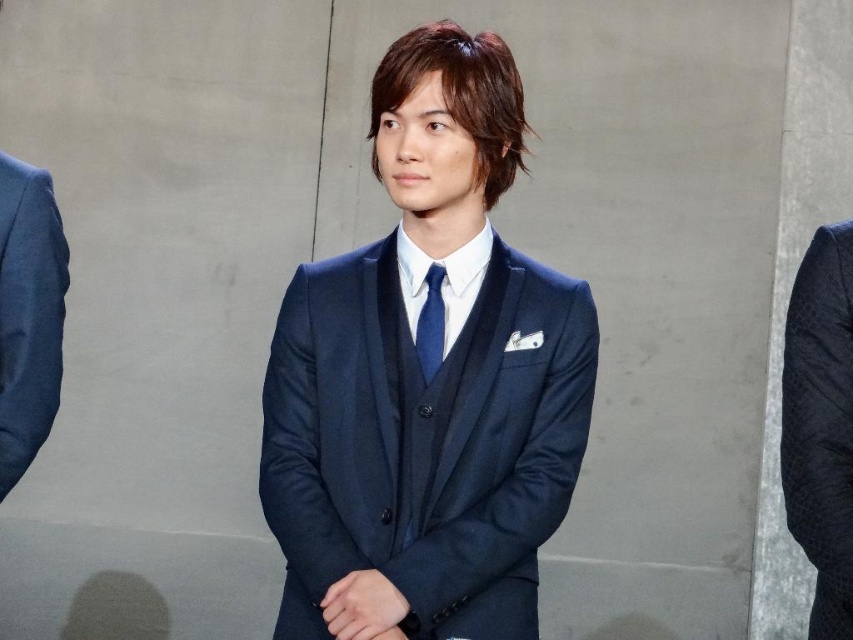
You are a photographer setting up for a formal photoshoot. You need to adjust the lighting so that the matte blue suit at left and the matte blue tie at center are evenly illuminated. Based on their positions, which object should you focus the light on first to ensure proper exposure?

The matte blue suit at left is located above the matte blue tie at center. Since it is higher up, you should focus the light on the matte blue suit at left first to ensure proper exposure before adjusting for the lower positioned tie.

You are a photographer adjusting the focus on your camera. You notice two points of interest in the image, point (x=61, y=348) and point (x=436, y=304). Which point should you focus on first to ensure the subject is sharp?

You should focus on point (x=61, y=348) first because it is closer to the camera than point (x=436, y=304), ensuring the subject appears sharp in the foreground.

You are a tailor measuring a navy blue suit at center and a matte blue tie at center for alterations. Which item requires a smaller amount of fabric for adjustments?

The matte blue tie at center requires less fabric for adjustments since it is smaller in size than the navy blue suit at center.